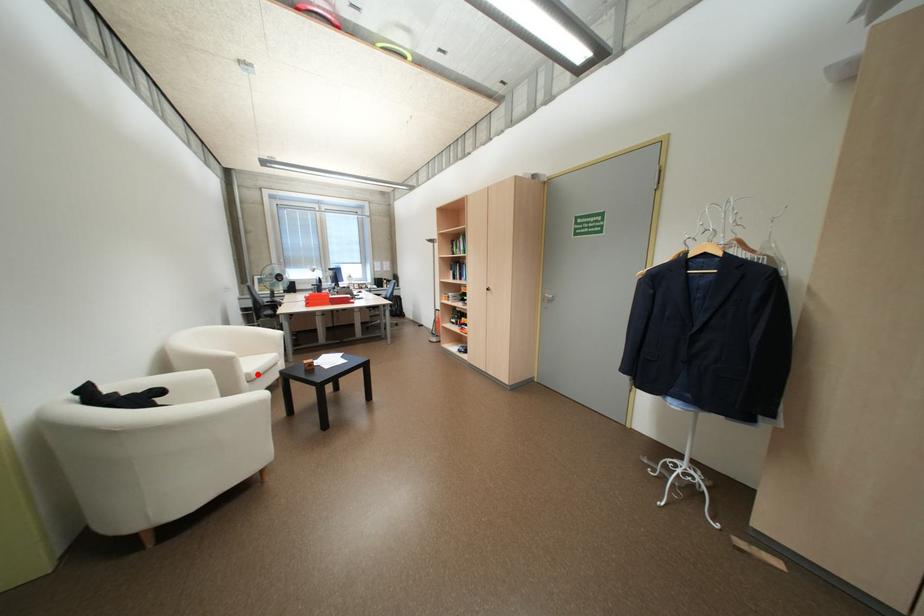
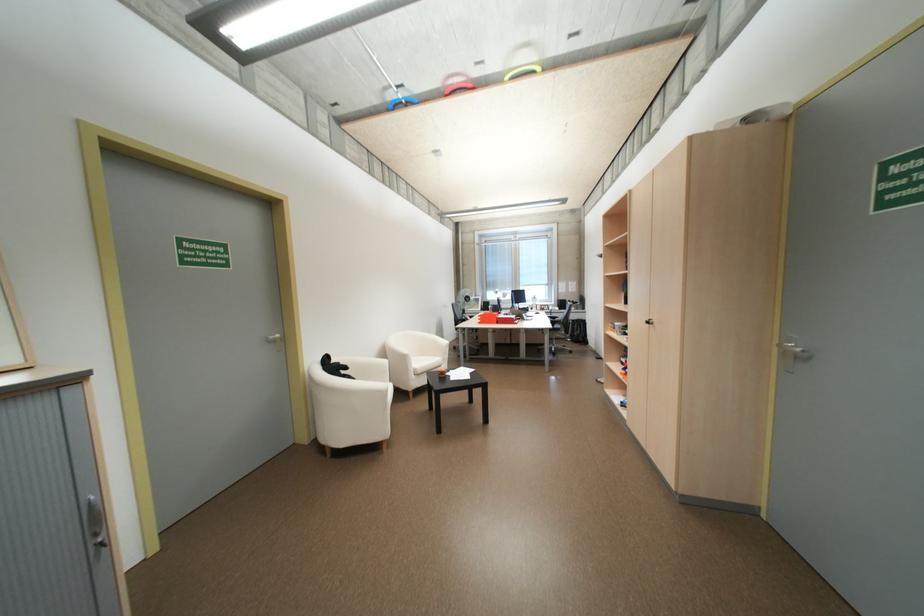
Question: I am providing you with two images of the same scene from different viewpoints. Image1 has a red point marked. In image2, the corresponding 3D location appears at what relative position? Reply with the corresponding letter.

Choices:
 (A) Closer
 (B) Farther

Answer: (B)